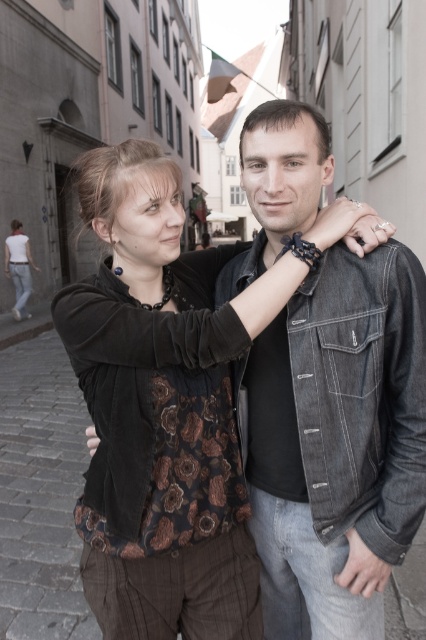
Question: Can you confirm if matte black jacket at center is bigger than denim jacket at center?

Choices:
 (A) no
 (B) yes

Answer: (B)

Question: Can you confirm if matte black jacket at center is positioned to the right of denim jacket at center?

Choices:
 (A) no
 (B) yes

Answer: (A)

Question: Among these points, which one is farthest from the camera?

Choices:
 (A) (319, 177)
 (B) (172, 490)

Answer: (A)

Question: Which is nearer to the matte black jacket at lower left?

Choices:
 (A) denim jacket at center
 (B) matte black jacket at center

Answer: (B)

Question: Which point is closer to the camera?

Choices:
 (A) (365, 480)
 (B) (158, 220)

Answer: (B)

Question: Can you confirm if denim jacket at center is thinner than matte black jacket at lower left?

Choices:
 (A) no
 (B) yes

Answer: (A)